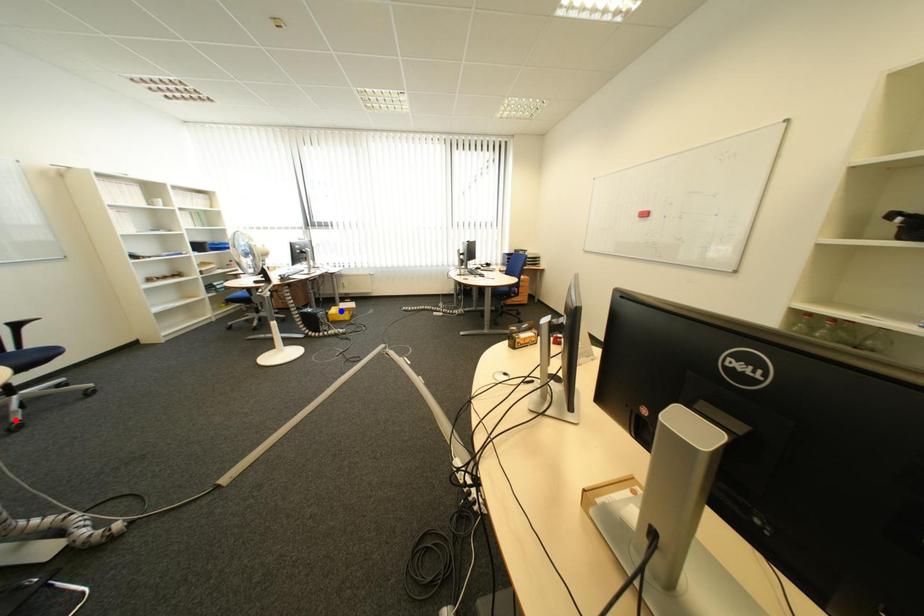
Question: Two points are marked on the image. Which point is closer to the camera?

Choices:
 (A) Blue point is closer.
 (B) Red point is closer.

Answer: (B)